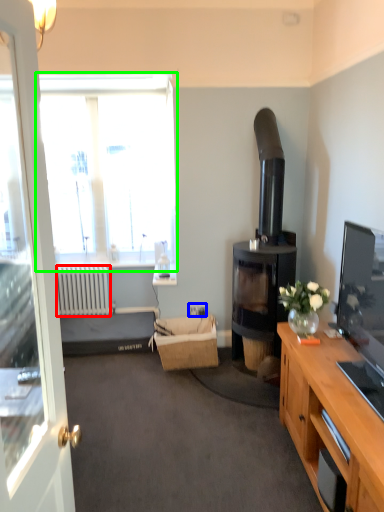
Question: Considering the real-world distances, which object is farthest from radiator (highlighted by a red box)? power outlet (highlighted by a blue box) or window (highlighted by a green box)?

Choices:
 (A) power outlet
 (B) window

Answer: (A)